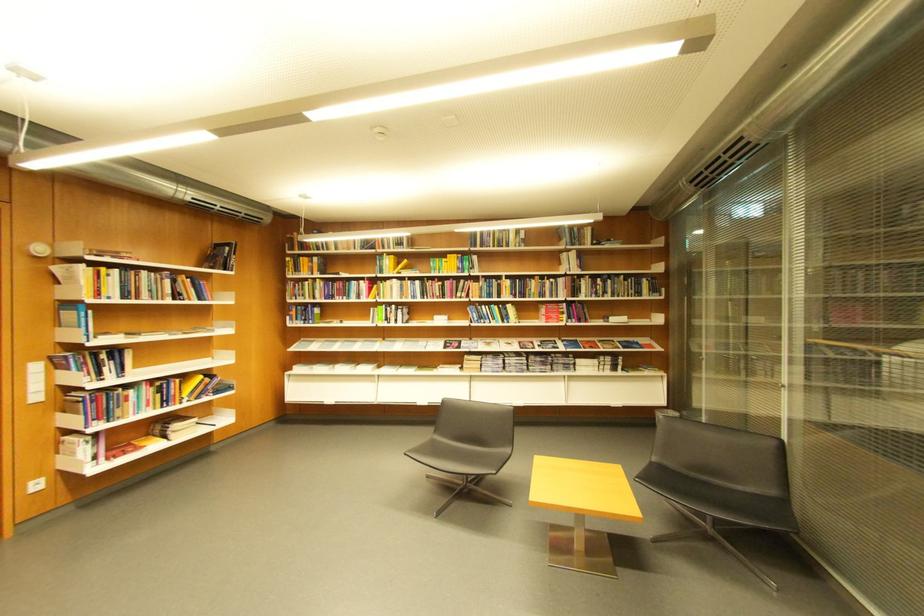
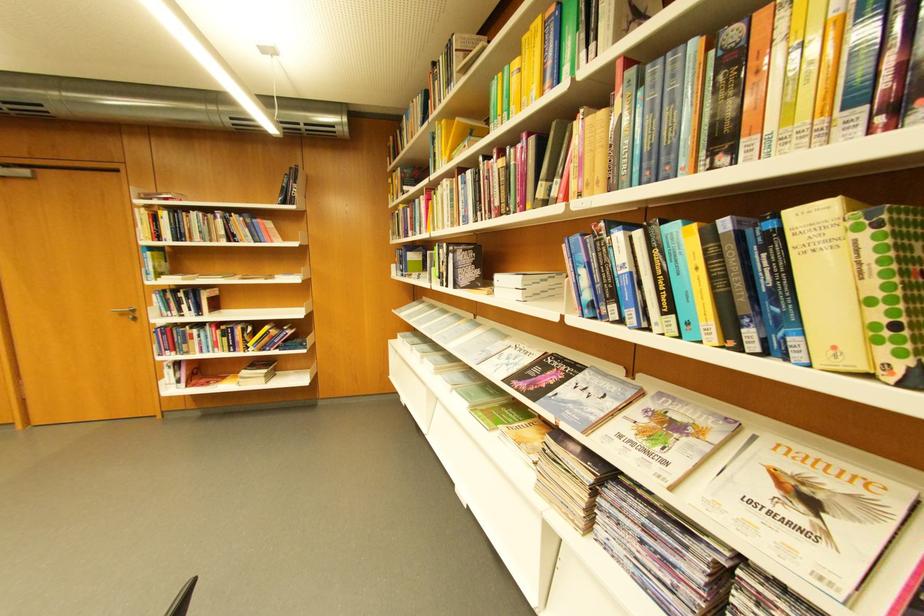
Find the pixel in the second image that matches point 397,321 in the first image.

(451, 278)